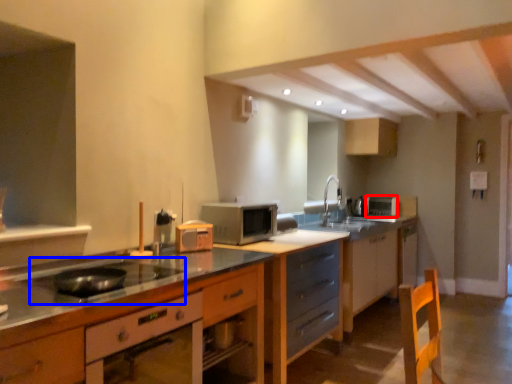
Question: Among these objects, which one is nearest to the camera, appliance (highlighted by a red box) or gas stove (highlighted by a blue box)?

Choices:
 (A) appliance
 (B) gas stove

Answer: (B)